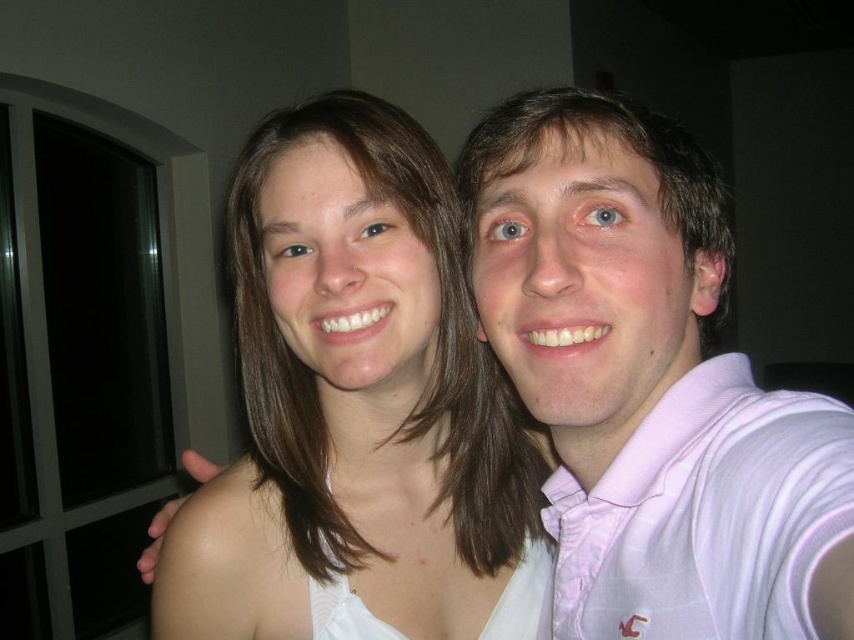
Question: Does white fabric at center have a larger size compared to pink striped polo shirt at upper right?

Choices:
 (A) no
 (B) yes

Answer: (B)

Question: Which point is farther to the camera?

Choices:
 (A) (633, 460)
 (B) (174, 577)

Answer: (B)

Question: Which of the following is the farthest from the observer?

Choices:
 (A) pink cotton polo shirt at right
 (B) pink striped polo shirt at upper right
 (C) white fabric at center

Answer: (C)

Question: Does pink striped polo shirt at upper right appear on the right side of pink cotton polo shirt at right?

Choices:
 (A) yes
 (B) no

Answer: (B)

Question: Is white fabric at center to the right of pink cotton polo shirt at right from the viewer's perspective?

Choices:
 (A) yes
 (B) no

Answer: (B)

Question: Which object is farther from the camera taking this photo?

Choices:
 (A) pink striped polo shirt at upper right
 (B) pink cotton polo shirt at right

Answer: (B)